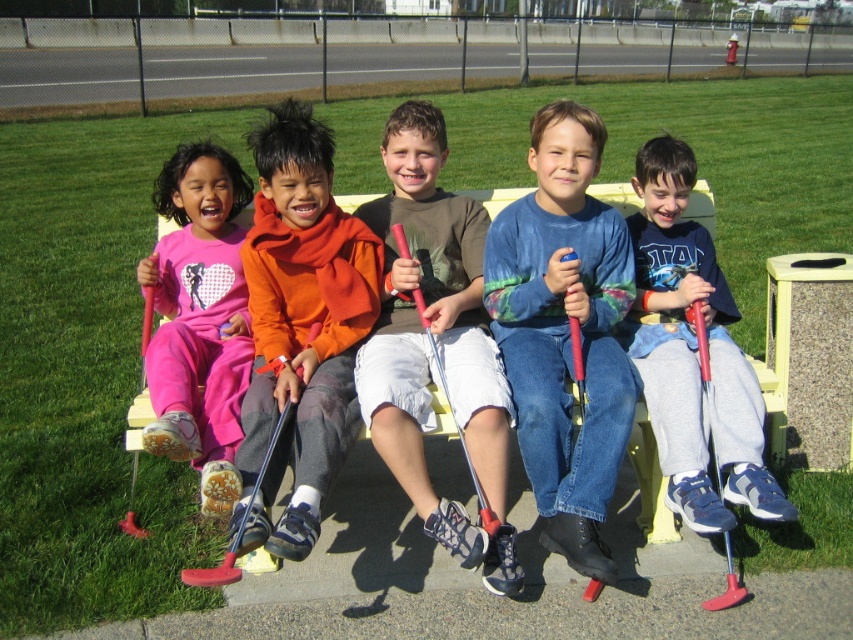
Question: Which of these objects is positioned closest to the orange fleece scarf at center?

Choices:
 (A) matte orange hoodie at center
 (B) blue tie-dye shirt at center
 (C) blue cotton shirt at center
 (D) yellow plastic bench at center

Answer: (A)

Question: Can you confirm if blue tie-dye shirt at center is bigger than matte orange hoodie at center?

Choices:
 (A) yes
 (B) no

Answer: (B)

Question: From the image, what is the correct spatial relationship of blue tie-dye shirt at center in relation to blue cotton shirt at center?

Choices:
 (A) above
 (B) below

Answer: (B)

Question: Which point is farther to the camera?

Choices:
 (A) matte orange hoodie at center
 (B) blue tie-dye shirt at center
 (C) yellow plastic bench at center

Answer: (C)

Question: Observing the image, what is the correct spatial positioning of orange fleece scarf at center in reference to matte orange hoodie at center?

Choices:
 (A) below
 (B) above

Answer: (B)

Question: Among these points, which one is farthest from the camera?

Choices:
 (A) (170, 388)
 (B) (424, 128)

Answer: (B)